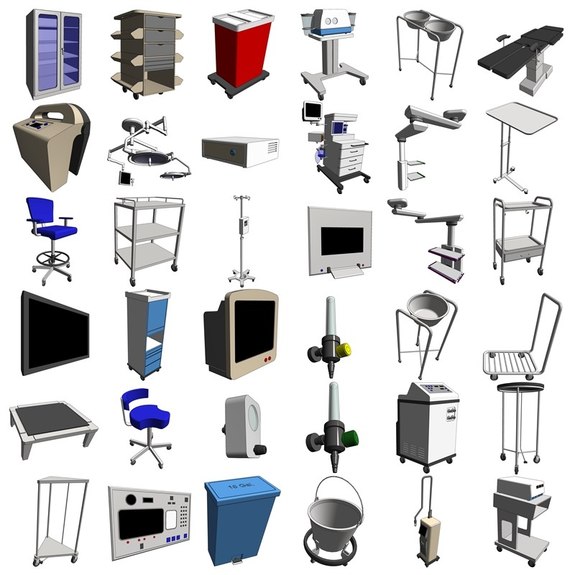
At what (x,y) coordinates should I click in order to perform the action: click on screen. Please return your answer as a coordinate pair (x, y). This screenshot has height=575, width=575. Looking at the image, I should click on (314, 113), (348, 237), (258, 325), (56, 336), (143, 520).